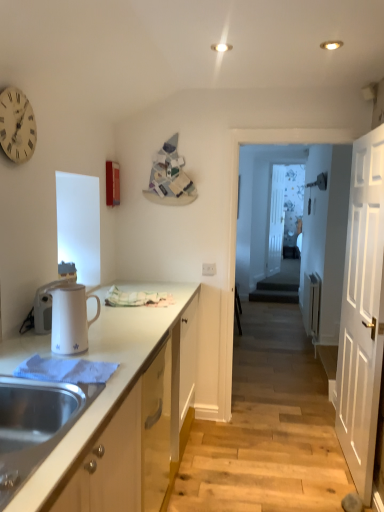
Image resolution: width=384 pixels, height=512 pixels. Find the location of `vacant space underneath white wooden door at right (from a real-world perspective)`. vacant space underneath white wooden door at right (from a real-world perspective) is located at coordinates (343, 460).